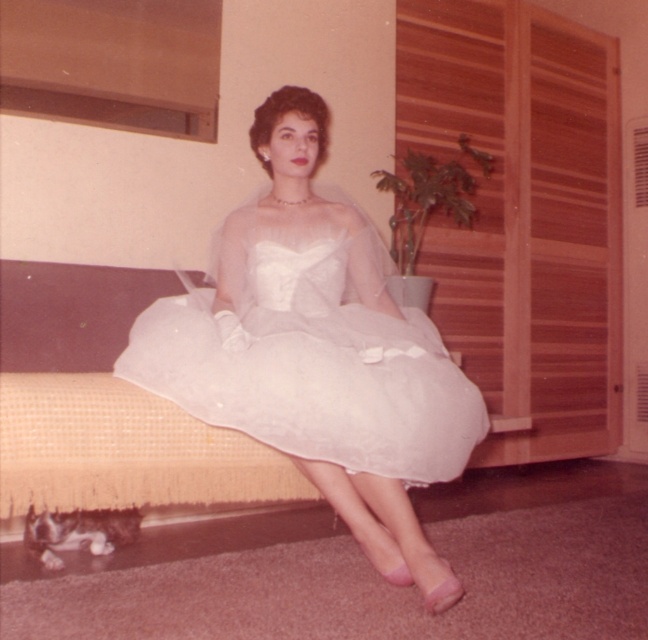
You are a photographer setting up a shoot in this vintage scene. You need to determine the layering of the dresses to adjust lighting. Which dress is closer to the camera, the white satin dress at center or the white sheer dress at center?

The white satin dress at center is positioned under the white sheer dress at center, so the white sheer dress at center is closer to the camera.

You are a photographer setting up for a formal portrait. You notice two dresses at the center of the scene, the white satin dress at center and the white sheer dress at center. Which dress should you focus on to ensure the subject is clearly visible in the photo?

The white satin dress at center is in front of the white sheer dress at center, so focusing on the white satin dress at center will ensure the subject is clearly visible.